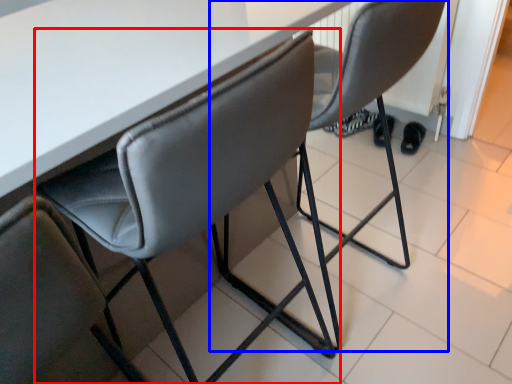
Question: Which object appears farthest to the camera in this image, chair (highlighted by a red box) or chair (highlighted by a blue box)?

Choices:
 (A) chair
 (B) chair

Answer: (B)